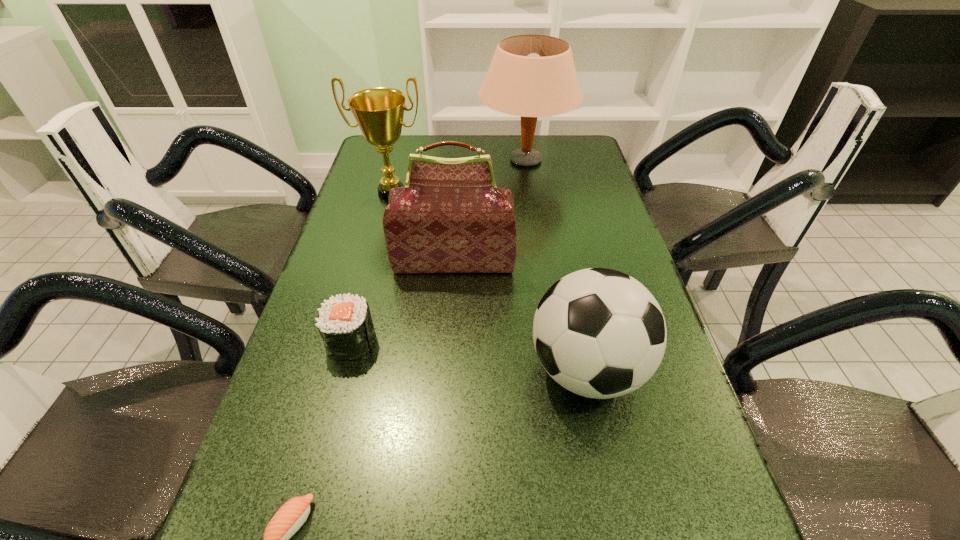
I want to click on free region at the left edge, so click(x=281, y=496).

At what (x,y) coordinates should I click in order to perform the action: click on free space at the right edge of the desktop. Please return your answer as a coordinate pair (x, y). The image size is (960, 540). Looking at the image, I should click on (580, 199).

Where is `free space between the award and the fourth tallest object`? free space between the award and the fourth tallest object is located at coordinates (490, 281).

Locate an element on the screen. Image resolution: width=960 pixels, height=540 pixels. vacant point located between the taller sushi and the soccer ball is located at coordinates 468,355.

Locate an element on the screen. This screenshot has width=960, height=540. free space between the handbag and the fourth tallest object is located at coordinates pyautogui.click(x=520, y=315).

Locate an element on the screen. This screenshot has width=960, height=540. free space that is in between the third shortest object and the third farthest object is located at coordinates (520, 315).

In order to click on vacant area between the soccer ball and the fourth nearest object in this screenshot , I will do `click(520, 315)`.

Identify the location of object that stands as the third closest to the lampshade. This screenshot has width=960, height=540. (599, 333).

Identify which object is the closest to the third shortest object. Please provide its 2D coordinates. Your answer should be formatted as a tuple, i.e. [(x, y)], where the tuple contains the x and y coordinates of a point satisfying the conditions above.

[(450, 217)]

What are the coordinates of `vacant space that satisfies the following two spatial constraints: 1. on the front-facing side of the lampshade; 2. on the front view with handles of the award` in the screenshot? It's located at (530, 193).